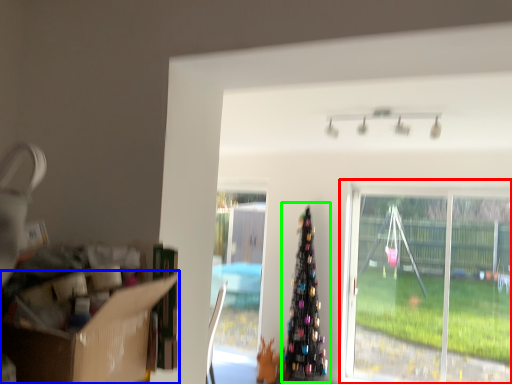
Question: Which object is the closest to the window (highlighted by a red box)? Choose among these: cardboard box (highlighted by a blue box) or christmas tree (highlighted by a green box).

Choices:
 (A) cardboard box
 (B) christmas tree

Answer: (B)